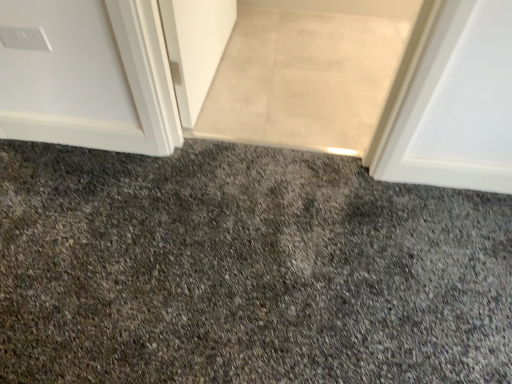
Question: Does gray textured carpet at center turn towards gray carpet at center?

Choices:
 (A) no
 (B) yes

Answer: (B)

Question: Does gray textured carpet at center come behind gray carpet at center?

Choices:
 (A) no
 (B) yes

Answer: (A)

Question: From the image's perspective, is gray textured carpet at center on gray carpet at center?

Choices:
 (A) no
 (B) yes

Answer: (A)

Question: From a real-world perspective, does gray textured carpet at center sit lower than gray carpet at center?

Choices:
 (A) yes
 (B) no

Answer: (B)

Question: Is gray carpet at center inside gray textured carpet at center?

Choices:
 (A) no
 (B) yes

Answer: (A)

Question: From the image's perspective, is gray textured carpet at center located beneath gray carpet at center?

Choices:
 (A) no
 (B) yes

Answer: (B)

Question: Does gray carpet at center have a greater width compared to gray textured carpet at center?

Choices:
 (A) no
 (B) yes

Answer: (B)

Question: Could you tell me if gray carpet at center is turned towards gray textured carpet at center?

Choices:
 (A) no
 (B) yes

Answer: (B)

Question: Is the depth of gray carpet at center greater than that of gray textured carpet at center?

Choices:
 (A) no
 (B) yes

Answer: (B)

Question: Considering the relative positions of gray carpet at center and gray textured carpet at center in the image provided, is gray carpet at center in front of gray textured carpet at center?

Choices:
 (A) no
 (B) yes

Answer: (A)

Question: Does gray carpet at center appear on the left side of gray textured carpet at center?

Choices:
 (A) no
 (B) yes

Answer: (A)

Question: Does gray carpet at center touch gray textured carpet at center?

Choices:
 (A) no
 (B) yes

Answer: (A)

Question: Relative to gray carpet at center, is gray textured carpet at center in front or behind?

Choices:
 (A) front
 (B) behind

Answer: (A)